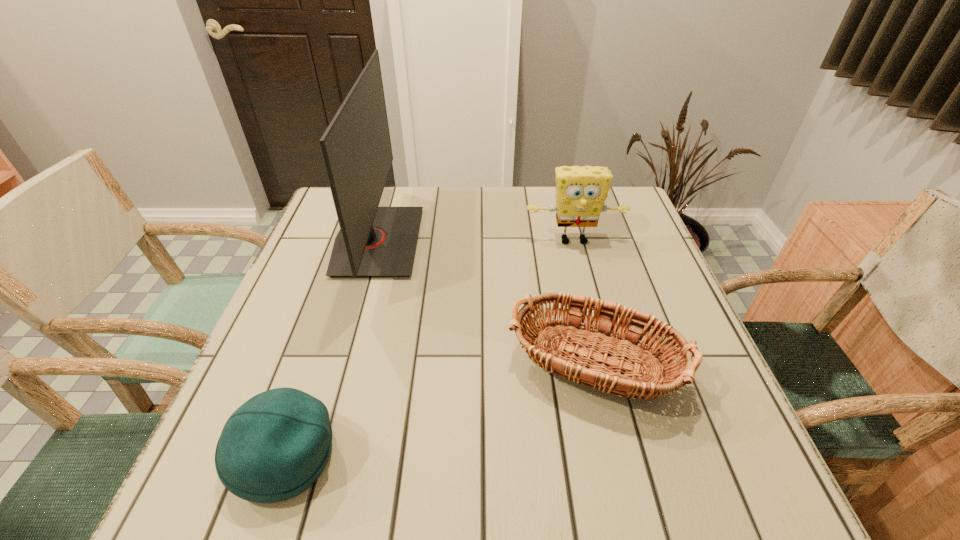
The width and height of the screenshot is (960, 540). Identify the location of vacant area that satisfies the following two spatial constraints: 1. on the screen side of the basket; 2. on the left side of the monitor. (339, 377).

Locate an element on the screen. This screenshot has width=960, height=540. free space that satisfies the following two spatial constraints: 1. on the screen side of the tallest object; 2. on the left side of the basket is located at coordinates (339, 377).

Where is `free region that satisfies the following two spatial constraints: 1. on the face of the second tallest object; 2. on the screen side of the monitor`? free region that satisfies the following two spatial constraints: 1. on the face of the second tallest object; 2. on the screen side of the monitor is located at coordinates (574, 241).